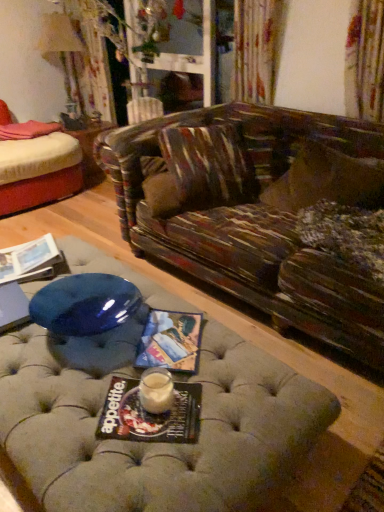
Question: Should I look upward or downward to see matte paper magazine at center, the second magazine viewed from the back?

Choices:
 (A) down
 (B) up

Answer: (A)

Question: Is matte black magazine at center, which is the first magazine from front to back, thinner than wooden side table at center?

Choices:
 (A) yes
 (B) no

Answer: (A)

Question: Does matte black magazine at center, which is the first magazine from front to back, have a greater height compared to wooden side table at center?

Choices:
 (A) yes
 (B) no

Answer: (B)

Question: From the image's perspective, does matte black magazine at center, which is the first magazine from bottom to top, appear higher than wooden side table at center?

Choices:
 (A) no
 (B) yes

Answer: (A)

Question: From a real-world perspective, is matte black magazine at center, the third magazine when ordered from back to front, physically above wooden side table at center?

Choices:
 (A) no
 (B) yes

Answer: (B)

Question: Does matte black magazine at center, which appears as the second magazine when viewed from the right, contain wooden side table at center?

Choices:
 (A) no
 (B) yes

Answer: (A)

Question: Is matte black magazine at center, which is the first magazine from bottom to top, shorter than wooden side table at center?

Choices:
 (A) no
 (B) yes

Answer: (B)

Question: Would you say matte paper magazine at center, which is the 3th magazine from left to right, is a long distance from matte black magazine at center, which appears as the second magazine when viewed from the right?

Choices:
 (A) no
 (B) yes

Answer: (A)

Question: Is matte paper magazine at center, which ranks as the 2th magazine in top-to-bottom order, next to matte black magazine at center, which is the first magazine from bottom to top?

Choices:
 (A) no
 (B) yes

Answer: (A)

Question: Is the position of matte paper magazine at center, which is the 3th magazine from left to right, more distant than that of matte black magazine at center, which is the first magazine from bottom to top?

Choices:
 (A) yes
 (B) no

Answer: (A)

Question: Would you say matte paper magazine at center, acting as the 1th magazine starting from the right, is outside matte black magazine at center, which is the first magazine from front to back?

Choices:
 (A) no
 (B) yes

Answer: (B)

Question: Is matte paper magazine at center, acting as the 1th magazine starting from the right, at the left side of matte black magazine at center, which appears as the second magazine when viewed from the right?

Choices:
 (A) no
 (B) yes

Answer: (A)

Question: Is matte paper magazine at center, the 2th magazine in the bottom-to-top sequence, positioned before matte black magazine at center, the third magazine when ordered from back to front?

Choices:
 (A) yes
 (B) no

Answer: (B)

Question: Is matte paper magazine at lower left, which ranks as the third magazine in right-to-left order, not within matte black magazine at center, which is the first magazine from front to back?

Choices:
 (A) yes
 (B) no

Answer: (A)